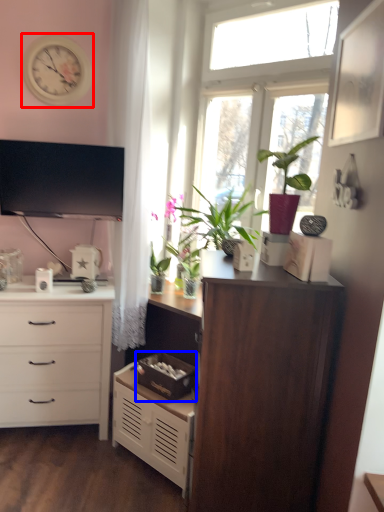
Question: Which object appears closest to the camera in this image, clock (highlighted by a red box) or storage box (highlighted by a blue box)?

Choices:
 (A) clock
 (B) storage box

Answer: (B)